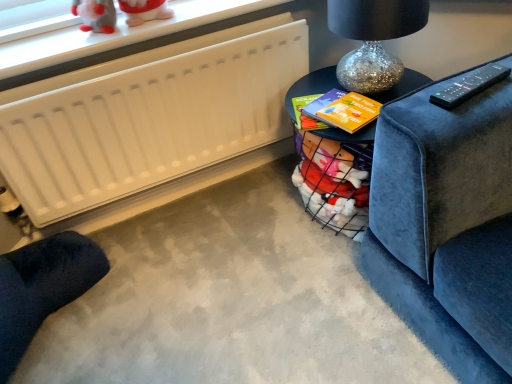
Identify the location of free spot behind matte black table at upper right, which is the second table from front to back. The image size is (512, 384). (316, 86).